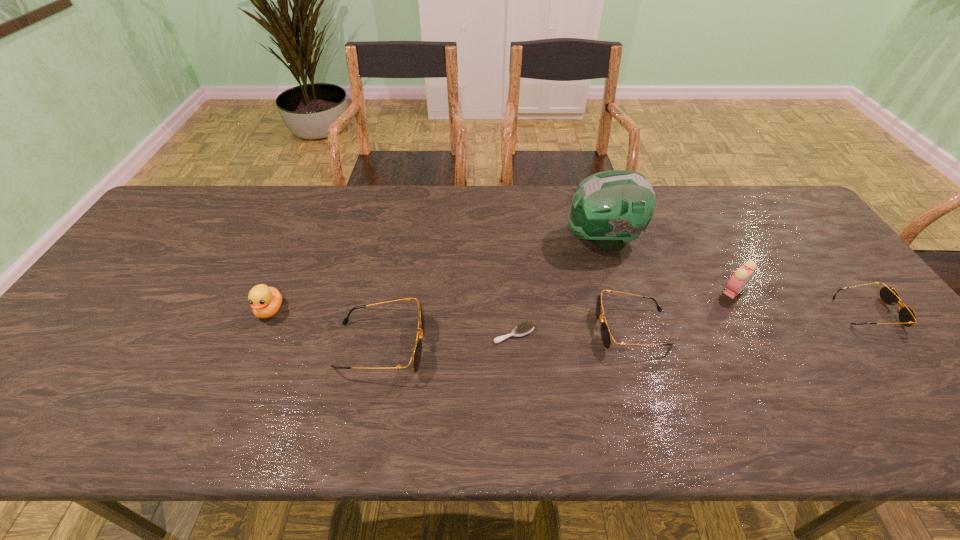
Locate an element on the screen. vacant space located 0.230m on the face of the sixth object from left to right is located at coordinates (780, 376).

Locate an element on the screen. The height and width of the screenshot is (540, 960). free space located 0.070m on the left of the fifth object from right to left is located at coordinates (465, 334).

Where is `object located at the far edge`? object located at the far edge is located at coordinates (611, 208).

This screenshot has height=540, width=960. I want to click on object situated at the near edge, so click(416, 355).

The width and height of the screenshot is (960, 540). In order to click on object positioned at the right edge in this screenshot , I will do `click(907, 317)`.

The image size is (960, 540). In the image, there is a desktop. Find the location of `vacant area at the far edge`. vacant area at the far edge is located at coordinates (548, 187).

Find the location of `vacant space at the near edge`. vacant space at the near edge is located at coordinates (458, 390).

You are a GUI agent. You are given a task and a screenshot of the screen. Output one action in this format:
    pyautogui.click(x=<x>, y=<y>)
    Task: Click on the vacant space at the right edge
    
    Given the screenshot: What is the action you would take?
    pyautogui.click(x=852, y=349)

Where is `free point at the far left corner`? Image resolution: width=960 pixels, height=540 pixels. free point at the far left corner is located at coordinates (159, 216).

You are a GUI agent. You are given a task and a screenshot of the screen. Output one action in this format:
    pyautogui.click(x=<x>, y=<y>)
    Task: Click on the free spot at the far right corner of the desktop
    
    Given the screenshot: What is the action you would take?
    pyautogui.click(x=772, y=211)